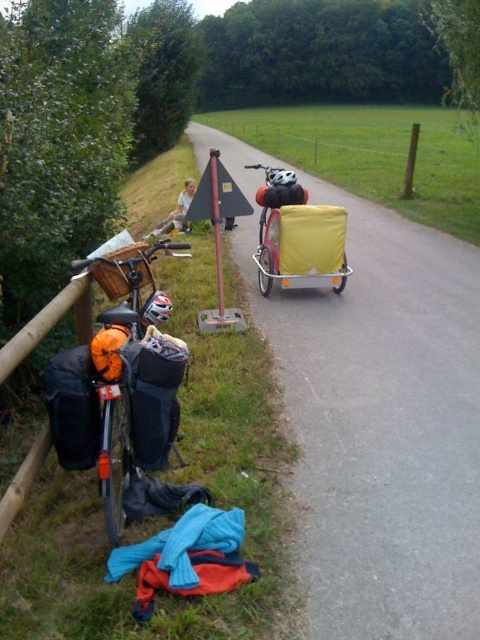
You are standing at the bicycle with panniers and a basket at the front and want to walk towards the triangular sign in the middle of the path. Which point, point (437, 422) or point (314, 157), will you encounter first?

You will encounter point (437, 422) first because it is closer to the viewer than point (314, 157).

You are a hiker who needs to place a 1.5 meter long backpack on the ground next to the orange fabric bag at left and the wooden post at center. Can you fit the backpack horizontally between them without it overlapping either object?

The orange fabric bag at left is shorter than the wooden post at center. Since the backpack is 1.5 meters long, and the distance between the two objects isn

You are a delivery person who needs to pick up a package from the orange fabric bag at left. Where exactly should you look for it?

Answer: The orange fabric bag at left is located at point (129,376).